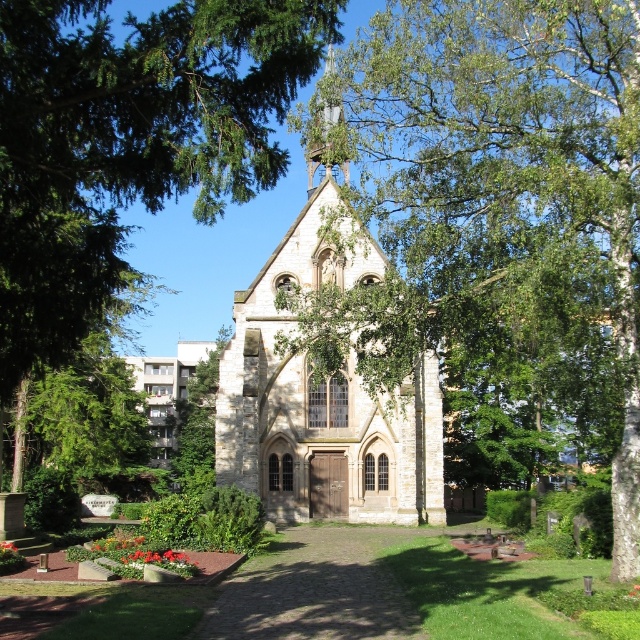
Which is above, green leafy tree at center or green leafy tree at upper left?

Positioned higher is green leafy tree at upper left.

Is point (440, 80) positioned in front of point (109, 186)?

No, (440, 80) is behind (109, 186).

This screenshot has height=640, width=640. Identify the location of green leafy tree at center. (497, 214).

Is point (308, 28) behind point (257, 284)?

No, (308, 28) is closer to viewer.

Between point (32, 252) and point (294, 236), which one is positioned in front?

Point (32, 252) is in front.

You are a GUI agent. You are given a task and a screenshot of the screen. Output one action in this format:
    pyautogui.click(x=<x>, y=<y>)
    Task: Click on the green leafy tree at upper left
    This screenshot has height=640, width=640.
    Given the screenshot: What is the action you would take?
    pyautogui.click(x=129, y=141)

Locate an element on the screen. green leafy tree at upper left is located at coordinates (129, 141).

Does green leafy tree at center come behind stone church at center?

No, green leafy tree at center is closer to the viewer.

Looking at this image, is green leafy tree at center above stone church at center?

Correct, green leafy tree at center is located above stone church at center.

Is point (428, 99) positioned behind point (257, 285)?

No, it is not.

You are a GUI agent. You are given a task and a screenshot of the screen. Output one action in this format:
    pyautogui.click(x=<x>, y=<y>)
    Task: Click on the green leafy tree at center
    The height and width of the screenshot is (640, 640).
    Given the screenshot: What is the action you would take?
    pyautogui.click(x=497, y=214)